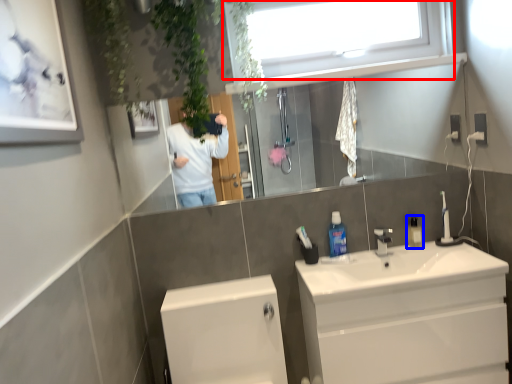
Question: Which object appears farthest to the camera in this image, window (highlighted by a red box) or mouthwash (highlighted by a blue box)?

Choices:
 (A) window
 (B) mouthwash

Answer: (B)